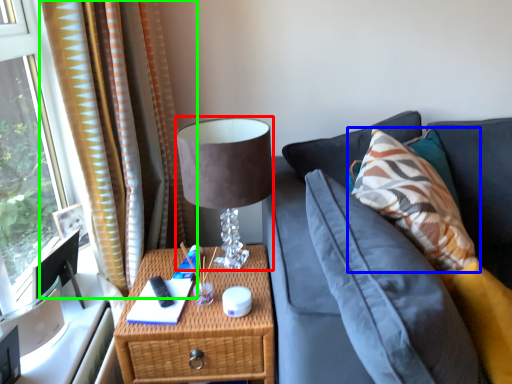
Question: Estimate the real-world distances between objects in this image. Which object is closer to table lamp (highlighted by a red box), pillow (highlighted by a blue box) or curtain (highlighted by a green box)?

Choices:
 (A) pillow
 (B) curtain

Answer: (B)